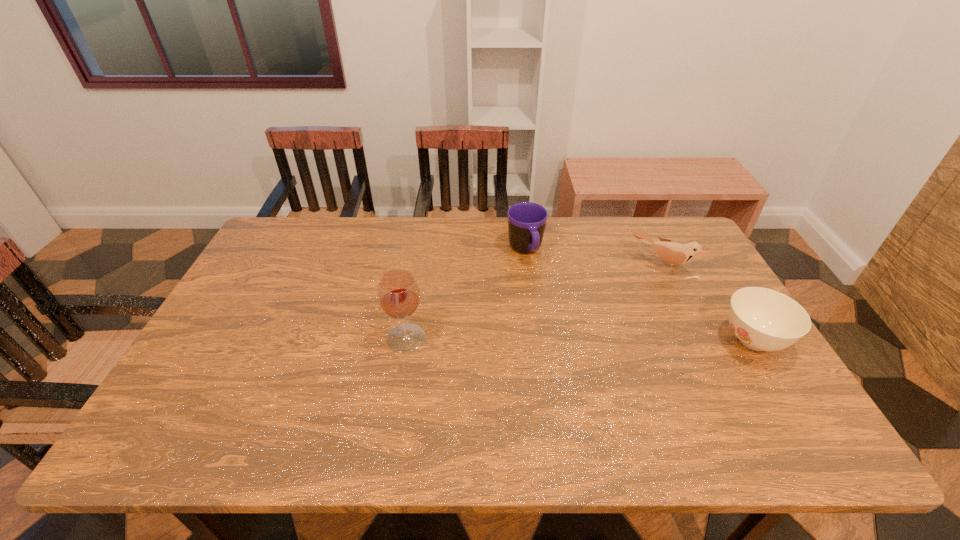
At what (x,y) coordinates should I click in order to perform the action: click on vacant space on the desktop that is between the wineglass and the sugar bowl and is positioned at the beak of the bird. Please return your answer as a coordinate pair (x, y). Looking at the image, I should click on (612, 340).

Image resolution: width=960 pixels, height=540 pixels. Find the location of `vacant spot on the desktop that is between the wineglass and the sugar bowl and is positioned with the handle on the side of the mug`. vacant spot on the desktop that is between the wineglass and the sugar bowl and is positioned with the handle on the side of the mug is located at coordinates (564, 339).